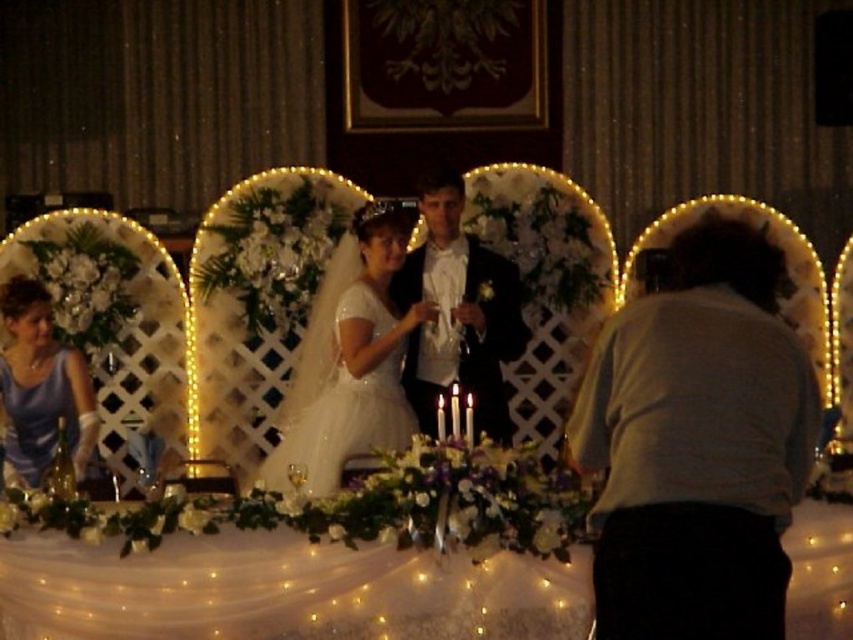
Question: Considering the real-world distances, which object is closest to the white satin dress at center?

Choices:
 (A) gray cotton shirt at right
 (B) matte blue dress at left
 (C) shiny black suit at center
 (D) white lace tablecloth at lower center

Answer: (C)

Question: Which of these objects is positioned farthest from the white lace tablecloth at lower center?

Choices:
 (A) white satin dress at center
 (B) shiny black suit at center

Answer: (B)

Question: Which object appears closest to the camera in this image?

Choices:
 (A) shiny black suit at center
 (B) white satin dress at center
 (C) gray cotton shirt at right
 (D) white lace tablecloth at lower center

Answer: (C)

Question: Is white lace tablecloth at lower center further to the viewer compared to matte blue dress at left?

Choices:
 (A) no
 (B) yes

Answer: (A)

Question: Is white satin dress at center positioned in front of shiny black suit at center?

Choices:
 (A) yes
 (B) no

Answer: (A)

Question: Does shiny black suit at center have a greater width compared to matte blue dress at left?

Choices:
 (A) yes
 (B) no

Answer: (B)